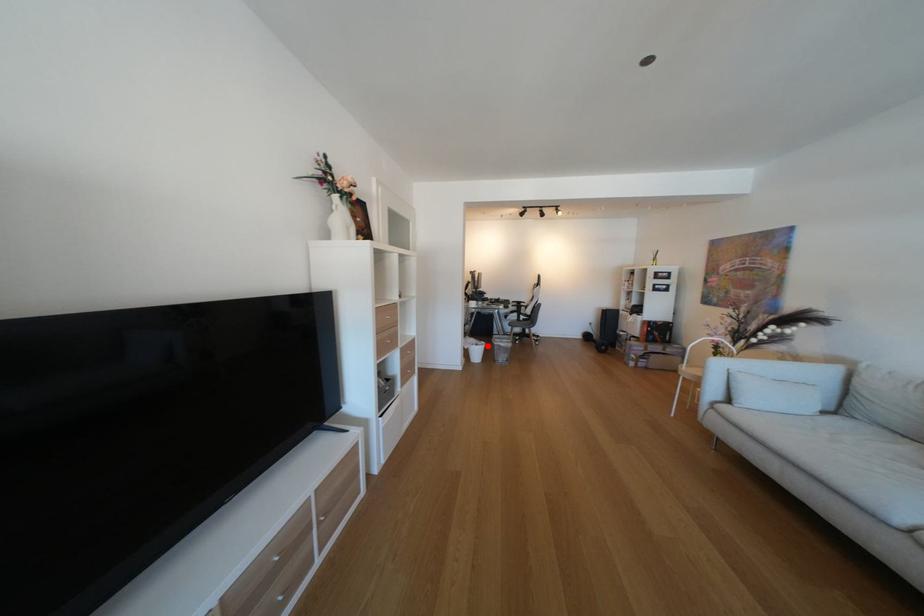
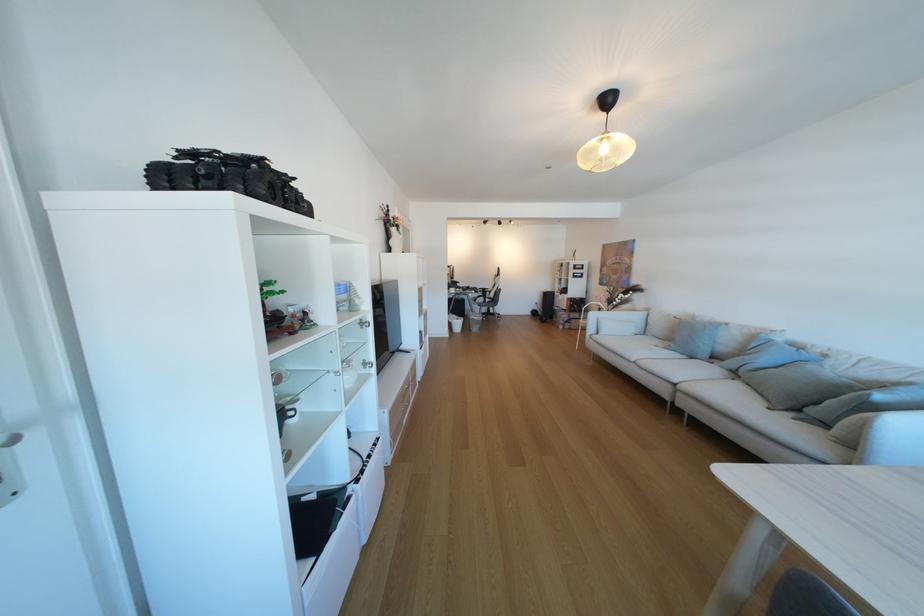
Question: I am providing you with two images of the same scene from different viewpoints. Given a red point in image1, look at the same physical point in image2. Is it:

Choices:
 (A) Closer to the viewpoint
 (B) Farther from the viewpoint

Answer: (A)